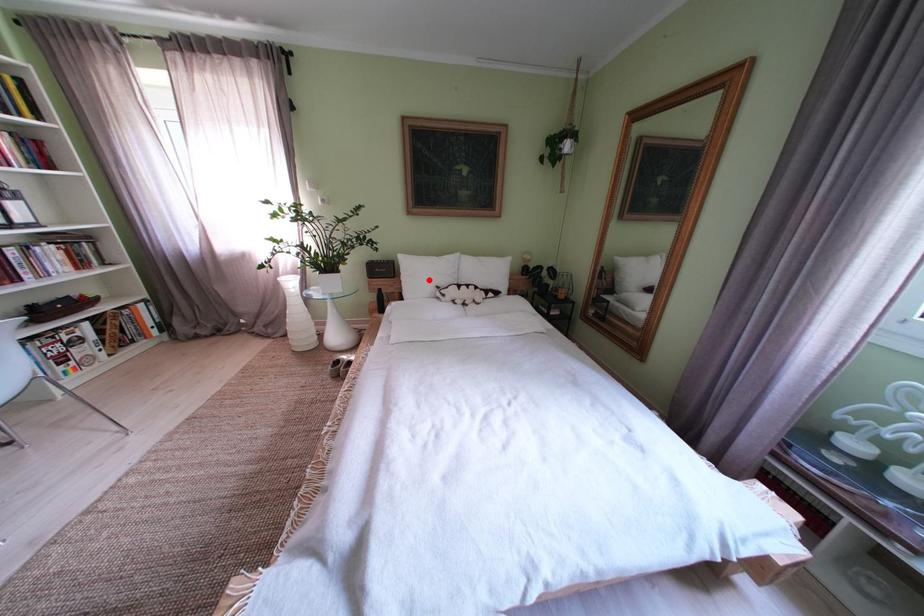
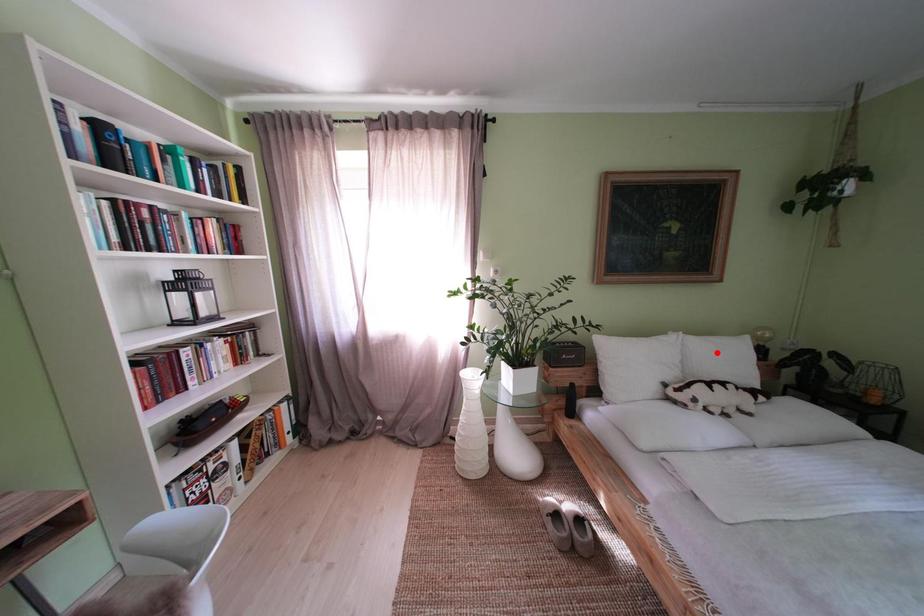
I am providing you with two images of the same scene from different viewpoints. A red point is marked on the first image and another point is marked on the second image. Do the highlighted points in image1 and image2 indicate the same real-world spot?

No